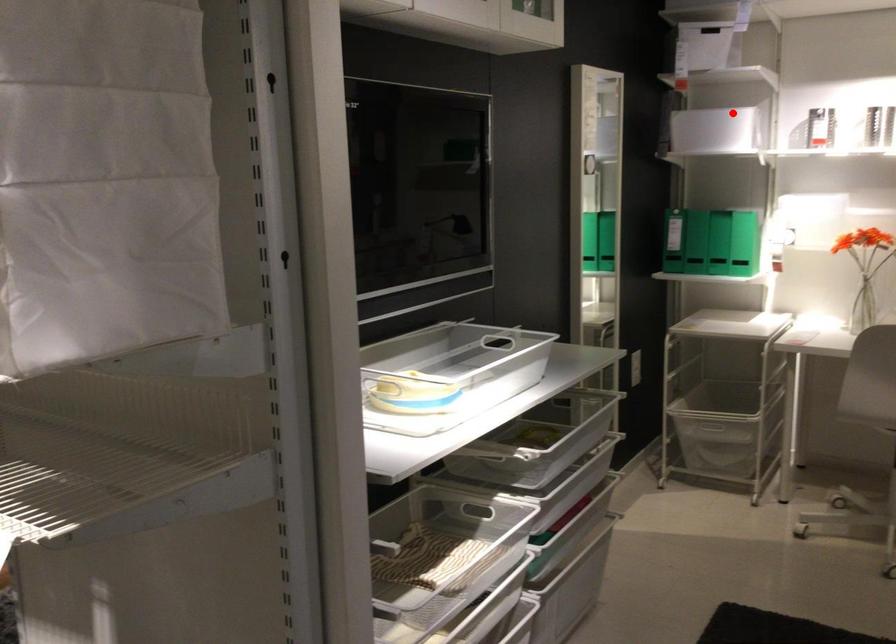
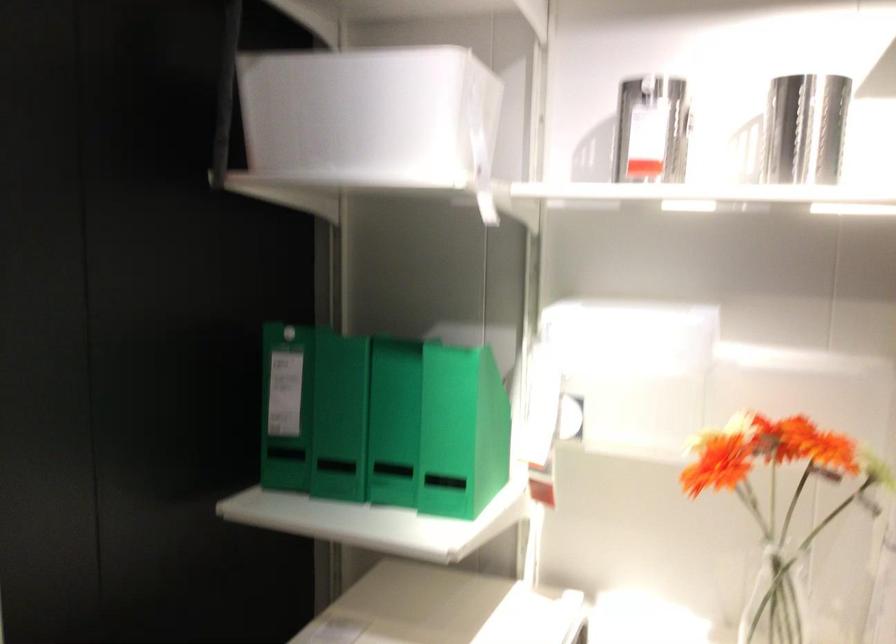
Question: I am providing you with two images of the same scene from different viewpoints. Image1 has a red point marked. In image2, the corresponding 3D location appears at what relative position? Reply with the corresponding letter.

Choices:
 (A) Closer
 (B) Farther

Answer: (A)